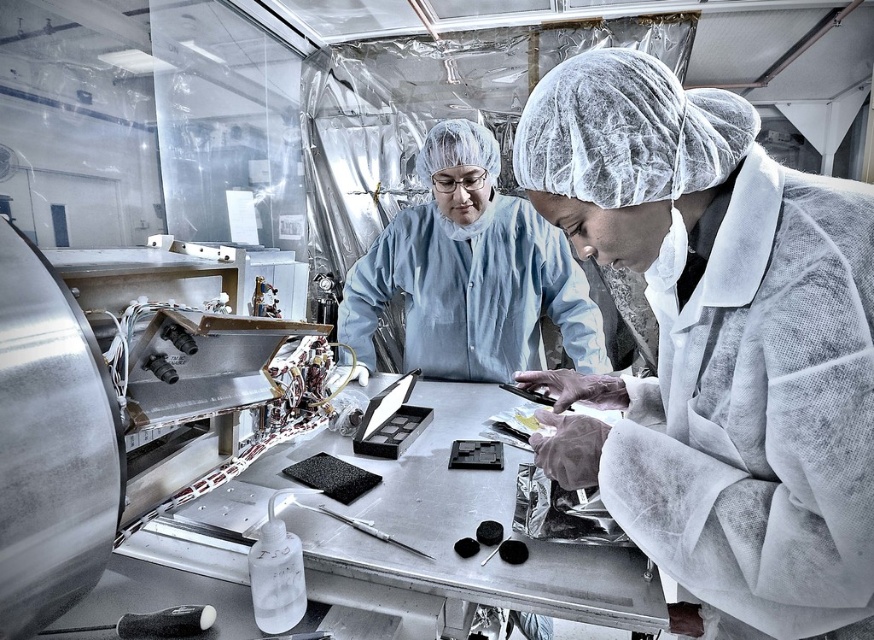
In the laboratory scene, both the white mesh robe at center and the blue fabric lab coat at center are present. Which of these two items is taller?

The white mesh robe at center is much taller than the blue fabric lab coat at center.

You are a technician working in the lab. You need to reach the point at coordinates point (656, 291). Your arm can extend 36 inches. Can you reach it?

The point (656, 291) is 37.83 inches from the viewer, which is slightly beyond your arm extension of 36 inches. You cannot reach it.

You are a new lab technician and need to put on both the white mesh robe at center and the blue fabric lab coat at center. Which one should you put on first according to the standard procedure?

According to standard lab procedures, you should put on the blue fabric lab coat at center first before the white mesh robe at center. This ensures proper layering where the robe is worn over the coat for contamination control.